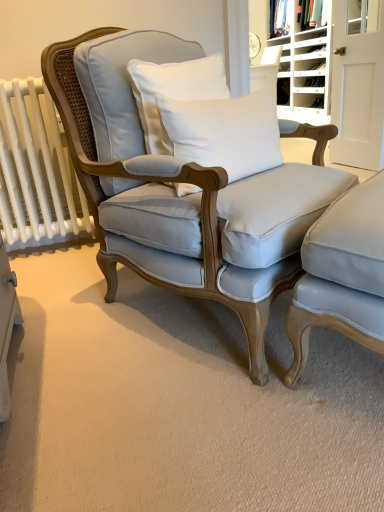
This screenshot has width=384, height=512. Describe the element at coordinates (173, 91) in the screenshot. I see `white cotton pillow at center, the first pillow in the top-to-bottom sequence` at that location.

What do you see at coordinates (342, 274) in the screenshot? This screenshot has height=512, width=384. I see `satin light blue armchair at lower right, positioned as the first chair in right-to-left order` at bounding box center [342, 274].

What are the coordinates of `matte white fabric at upper right` in the screenshot? It's located at (279, 18).

This screenshot has width=384, height=512. Identify the location of white wood door at upper right. (358, 84).

Considering the relative positions of white cotton pillow at center, the first pillow in the top-to-bottom sequence, and white cotton pillow at center, the 2th pillow in the top-to-bottom sequence, in the image provided, is white cotton pillow at center, the first pillow in the top-to-bottom sequence, behind white cotton pillow at center, the 2th pillow in the top-to-bottom sequence,?

Yes, it is.

Is white cotton pillow at center, the first pillow in the bottom-to-top sequence, at the back of white cotton pillow at center, the second pillow when ordered from bottom to top?

No, white cotton pillow at center, the second pillow when ordered from bottom to top, is not facing away from white cotton pillow at center, the first pillow in the bottom-to-top sequence.

Considering the relative sizes of white cotton pillow at center, the second pillow when ordered from bottom to top, and white cotton pillow at center, the 2th pillow in the top-to-bottom sequence, in the image provided, is white cotton pillow at center, the second pillow when ordered from bottom to top, shorter than white cotton pillow at center, the 2th pillow in the top-to-bottom sequence,?

In fact, white cotton pillow at center, the second pillow when ordered from bottom to top, may be taller than white cotton pillow at center, the 2th pillow in the top-to-bottom sequence.

Is white cotton pillow at center, the second pillow when ordered from bottom to top, wider than matte white fabric at upper right?

In fact, white cotton pillow at center, the second pillow when ordered from bottom to top, might be narrower than matte white fabric at upper right.

Which is nearer, [189,100] or [274,29]?

The point [189,100] is more forward.

Identify the location of fabric lying behind the white cotton pillow at center, the second pillow when ordered from bottom to top. The image size is (384, 512). (279, 18).

Is satin light blue armchair at lower right, positioned as the first chair in right-to-left order, not near white cotton pillow at center, the second pillow when ordered from bottom to top?

No, satin light blue armchair at lower right, positioned as the first chair in right-to-left order, is not far from white cotton pillow at center, the second pillow when ordered from bottom to top.

Which of these two, satin light blue armchair at lower right, positioned as the first chair in right-to-left order, or white cotton pillow at center, the second pillow when ordered from bottom to top, is smaller?

white cotton pillow at center, the second pillow when ordered from bottom to top, is smaller.

Is satin light blue armchair at lower right, positioned as the first chair in right-to-left order, looking in the opposite direction of white cotton pillow at center, the first pillow in the top-to-bottom sequence?

satin light blue armchair at lower right, positioned as the first chair in right-to-left order, does not have its back to white cotton pillow at center, the first pillow in the top-to-bottom sequence.

From a real-world perspective, is white cotton pillow at center, the 2th pillow in the top-to-bottom sequence, above or below matte white fabric at upper right?

white cotton pillow at center, the 2th pillow in the top-to-bottom sequence, is situated lower than matte white fabric at upper right in the real world.

Who is shorter, white cotton pillow at center, the 2th pillow in the top-to-bottom sequence, or matte white fabric at upper right?

With less height is white cotton pillow at center, the 2th pillow in the top-to-bottom sequence.

Is matte white fabric at upper right at the back of white cotton pillow at center, the 2th pillow in the top-to-bottom sequence?

white cotton pillow at center, the 2th pillow in the top-to-bottom sequence, is not turned away from matte white fabric at upper right.

What's the angular difference between white cotton pillow at center, the 2th pillow in the top-to-bottom sequence, and matte white fabric at upper right's facing directions?

The facing directions of white cotton pillow at center, the 2th pillow in the top-to-bottom sequence, and matte white fabric at upper right are 114 degrees apart.

From the image's perspective, is white cotton pillow at center, the 2th pillow in the top-to-bottom sequence, on white wood door at upper right?

No, from the image's perspective, white cotton pillow at center, the 2th pillow in the top-to-bottom sequence, is not over white wood door at upper right.

Looking at this image, is white cotton pillow at center, the first pillow in the bottom-to-top sequence, behind white wood door at upper right?

No, white cotton pillow at center, the first pillow in the bottom-to-top sequence, is closer to the camera.

From a real-world perspective, is white cotton pillow at center, the first pillow in the bottom-to-top sequence, beneath white wood door at upper right?

Correct, in the physical world, white cotton pillow at center, the first pillow in the bottom-to-top sequence, is lower than white wood door at upper right.

Which object is further away from the camera, satin light blue armchair at lower right, positioned as the first chair in right-to-left order, or white wood bookshelf at upper right?

white wood bookshelf at upper right is further away from the camera.

Does point (361, 204) come farther from viewer compared to point (382, 163)?

That is False.

From a real-world perspective, does satin light blue armchair at lower right, positioned as the first chair in right-to-left order, stand above white wood bookshelf at upper right?

No.

Based on the photo, from the image's perspective, which is below, satin light blue armchair at lower right, positioned as the first chair in right-to-left order, or white wood bookshelf at upper right?

From the image's view, satin light blue armchair at lower right, positioned as the first chair in right-to-left order, is below.

Which chair is the 2nd one when counting from the left side of the matte white fabric at upper right? Please provide its 2D coordinates.

[(191, 184)]

Based on their sizes in the image, would you say matte white fabric at upper right is bigger or smaller than light blue fabric chair at center, the second chair viewed from the right?

Clearly, matte white fabric at upper right is smaller in size than light blue fabric chair at center, the second chair viewed from the right.

From the image's perspective, is matte white fabric at upper right positioned above or below light blue fabric chair at center, the second chair viewed from the right?

matte white fabric at upper right is situated higher than light blue fabric chair at center, the second chair viewed from the right, in the image.

At what (x,y) coordinates should I click in order to perform the action: click on pillow that is in front of the white cotton pillow at center, the second pillow when ordered from bottom to top. Please return your answer as a coordinate pair (x, y). Image resolution: width=384 pixels, height=512 pixels. Looking at the image, I should click on (224, 132).

The height and width of the screenshot is (512, 384). Find the location of `fabric to the right of white cotton pillow at center, the first pillow in the top-to-bottom sequence`. fabric to the right of white cotton pillow at center, the first pillow in the top-to-bottom sequence is located at coordinates (279, 18).

Which object lies further to the anchor point satin light blue armchair at lower right, acting as the second chair starting from the left, white cotton pillow at center, the first pillow in the top-to-bottom sequence, or white wood door at upper right?

white wood door at upper right lies further to satin light blue armchair at lower right, acting as the second chair starting from the left, than the other object.

From the image, which object appears to be nearer to white plastic shoe rack at upper right, white cotton pillow at center, the 2th pillow in the top-to-bottom sequence, or white cotton pillow at center, the first pillow in the top-to-bottom sequence?

Among the two, white cotton pillow at center, the first pillow in the top-to-bottom sequence, is located nearer to white plastic shoe rack at upper right.

Looking at the image, which one is located closer to matte white fabric at upper right, light blue fabric chair at center, the second chair viewed from the right, or white cotton pillow at center, the second pillow when ordered from bottom to top?

white cotton pillow at center, the second pillow when ordered from bottom to top.

From the image, which object appears to be farther from white cotton pillow at center, the 2th pillow in the top-to-bottom sequence, satin light blue armchair at lower right, acting as the second chair starting from the left, or white plastic shoe rack at upper right?

Based on the image, white plastic shoe rack at upper right appears to be further to white cotton pillow at center, the 2th pillow in the top-to-bottom sequence.

Considering their positions, is white plastic shoe rack at upper right positioned closer to matte white fabric at upper right than white cotton pillow at center, the 2th pillow in the top-to-bottom sequence?

The object closer to matte white fabric at upper right is white plastic shoe rack at upper right.

From the image, which object appears to be farther from satin light blue armchair at lower right, acting as the second chair starting from the left, white wood bookshelf at upper right or white cotton pillow at center, the first pillow in the bottom-to-top sequence?

white wood bookshelf at upper right.

Looking at this image, when comparing their distances from satin light blue armchair at lower right, acting as the second chair starting from the left, does white wood door at upper right or light blue fabric chair at center, which appears as the first chair when viewed from the left, seem closer?

light blue fabric chair at center, which appears as the first chair when viewed from the left.

Which object lies further to the anchor point white cotton pillow at center, the second pillow when ordered from bottom to top, white wood bookshelf at upper right or light blue fabric chair at center, the second chair viewed from the right?

The object further to white cotton pillow at center, the second pillow when ordered from bottom to top, is white wood bookshelf at upper right.

Locate an element on the screen. Image resolution: width=384 pixels, height=512 pixels. chair between light blue fabric chair at center, the second chair viewed from the right, and matte white fabric at upper right in the front-back direction is located at coordinates (342, 274).

Find the location of a particular element. door positioned between white wood bookshelf at upper right and white plastic shoe rack at upper right from near to far is located at coordinates (358, 84).

The width and height of the screenshot is (384, 512). Identify the location of pillow between white cotton pillow at center, the 2th pillow in the top-to-bottom sequence, and white wood door at upper right in the front-back direction. (173, 91).

Where is `door between white wood bookshelf at upper right and matte white fabric at upper right in the front-back direction`? Image resolution: width=384 pixels, height=512 pixels. door between white wood bookshelf at upper right and matte white fabric at upper right in the front-back direction is located at coordinates (358, 84).